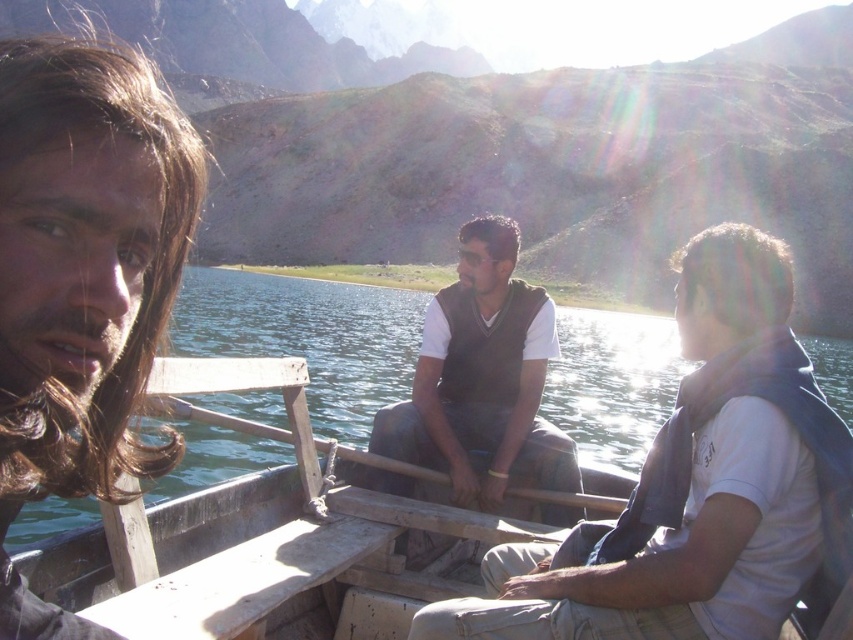
You are a photographer standing in front of the wooden boat. You want to take a photo of both point (x=775, y=282) and point (x=61, y=161). Which point will appear closer to the camera in the photo?

Point (x=775, y=282) is further to the camera than point (x=61, y=161), so it will appear closer to the camera in the photo.